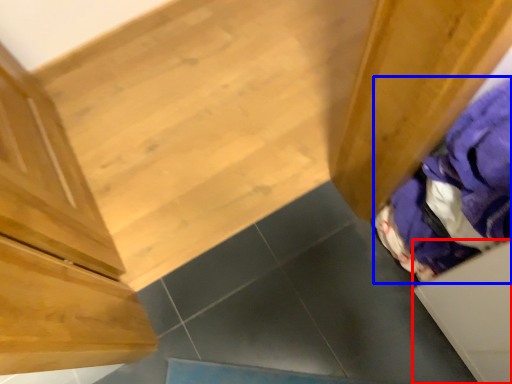
Question: Which object appears closest to the camera in this image, drawer (highlighted by a red box) or clothing (highlighted by a blue box)?

Choices:
 (A) drawer
 (B) clothing

Answer: (A)